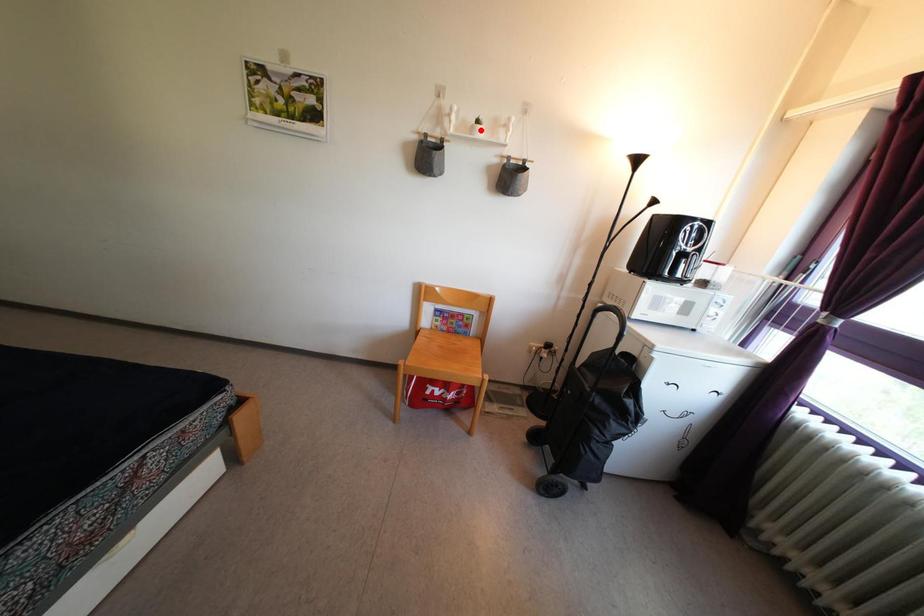
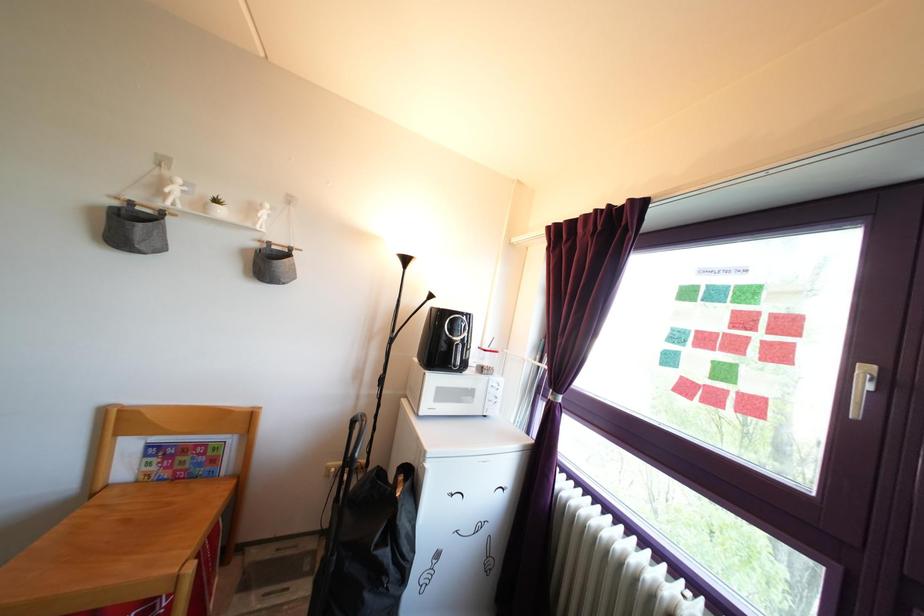
Find the pixel in the second image that matches the highlighted location in the first image.

(219, 209)